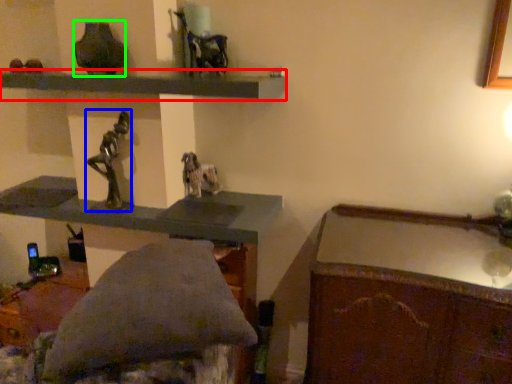
Question: Which object is the closest to the shelf (highlighted by a red box)? Choose among these: figurine (highlighted by a blue box) or vase (highlighted by a green box).

Choices:
 (A) figurine
 (B) vase

Answer: (B)